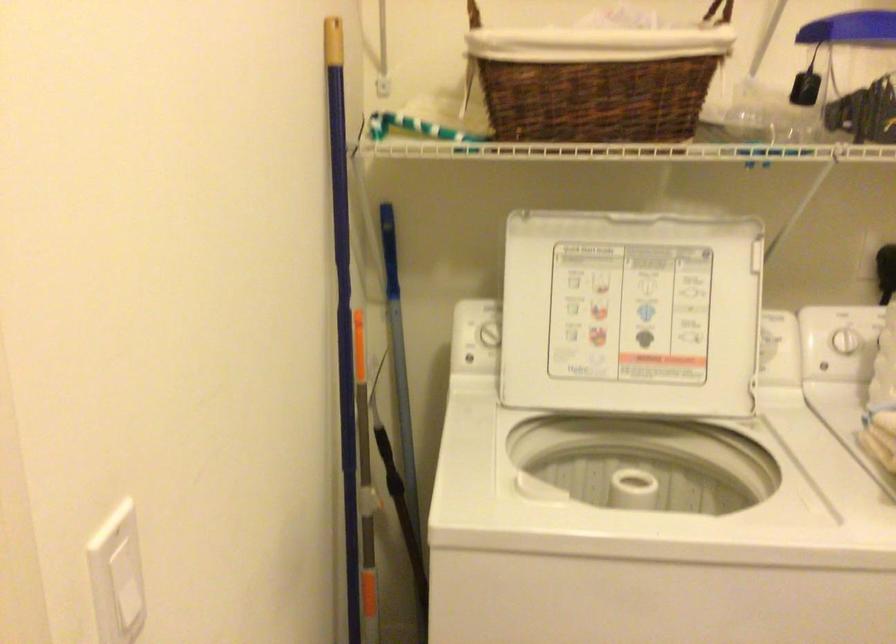
Image resolution: width=896 pixels, height=644 pixels. What do you see at coordinates (116, 576) in the screenshot?
I see `the white light switch` at bounding box center [116, 576].